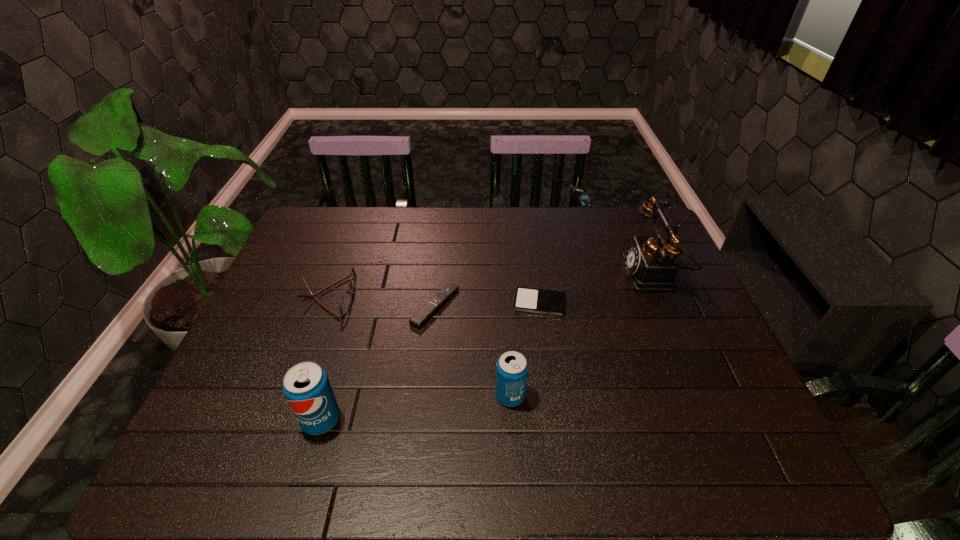
You are a GUI agent. You are given a task and a screenshot of the screen. Output one action in this format:
    pyautogui.click(x=<x>, y=<y>)
    Task: Click on the blank region between the right soda can and the second tallest object
    The height and width of the screenshot is (540, 960).
    Given the screenshot: What is the action you would take?
    pyautogui.click(x=416, y=408)

The width and height of the screenshot is (960, 540). Find the location of `free space between the shortest object and the tallest object`. free space between the shortest object and the tallest object is located at coordinates (596, 289).

The height and width of the screenshot is (540, 960). In order to click on free point between the iPod and the rightmost object in this screenshot , I will do `click(596, 289)`.

Locate an element on the screen. The height and width of the screenshot is (540, 960). free space that is in between the left soda can and the remote control is located at coordinates (378, 363).

At what (x,y) coordinates should I click in order to perform the action: click on free area in between the shorter soda can and the fourth tallest object. Please return your answer as a coordinate pair (x, y). Looking at the image, I should click on (420, 346).

Identify the location of free space that is in between the rightmost object and the fourth tallest object. Image resolution: width=960 pixels, height=540 pixels. (491, 286).

Image resolution: width=960 pixels, height=540 pixels. Find the location of `object that stands as the third closest to the taller soda can`. object that stands as the third closest to the taller soda can is located at coordinates (512, 368).

Where is `object that is the fourth closest one to the remote control`? The height and width of the screenshot is (540, 960). object that is the fourth closest one to the remote control is located at coordinates (306, 386).

The image size is (960, 540). In order to click on free space that satisfies the following two spatial constraints: 1. on the front-facing side of the iPod; 2. on the right side of the spectacles in this screenshot , I will do `click(326, 303)`.

Find the location of `free space that satisfies the following two spatial constraints: 1. on the front-facing side of the fourth tallest object; 2. on the back side of the iPod`. free space that satisfies the following two spatial constraints: 1. on the front-facing side of the fourth tallest object; 2. on the back side of the iPod is located at coordinates (326, 303).